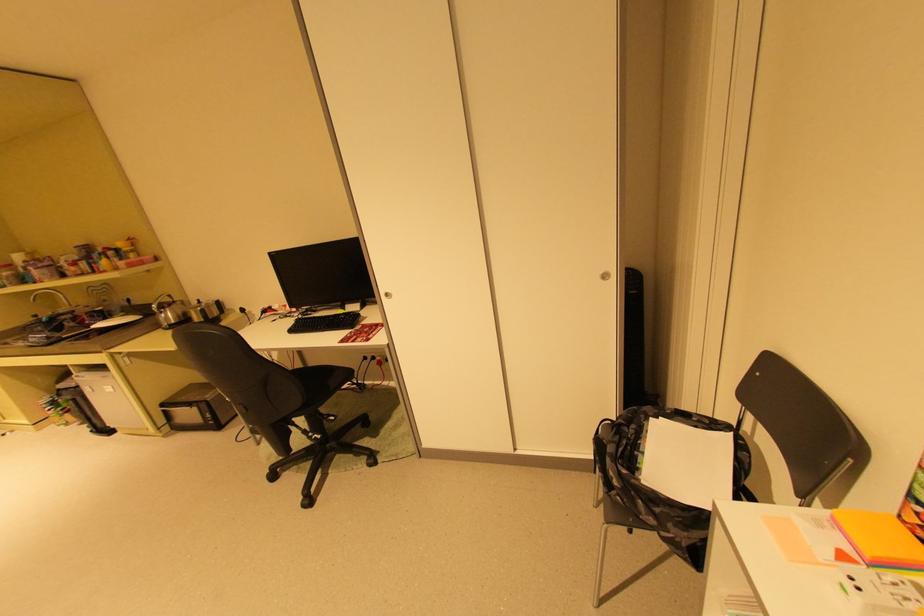
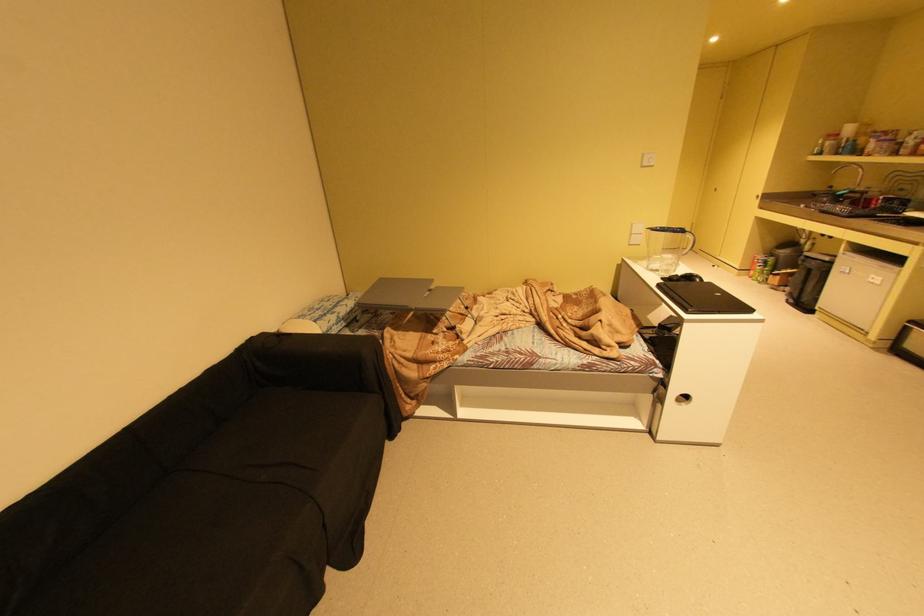
Find the pixel in the second image that matches the point at 100,431 in the first image.

(796, 301)